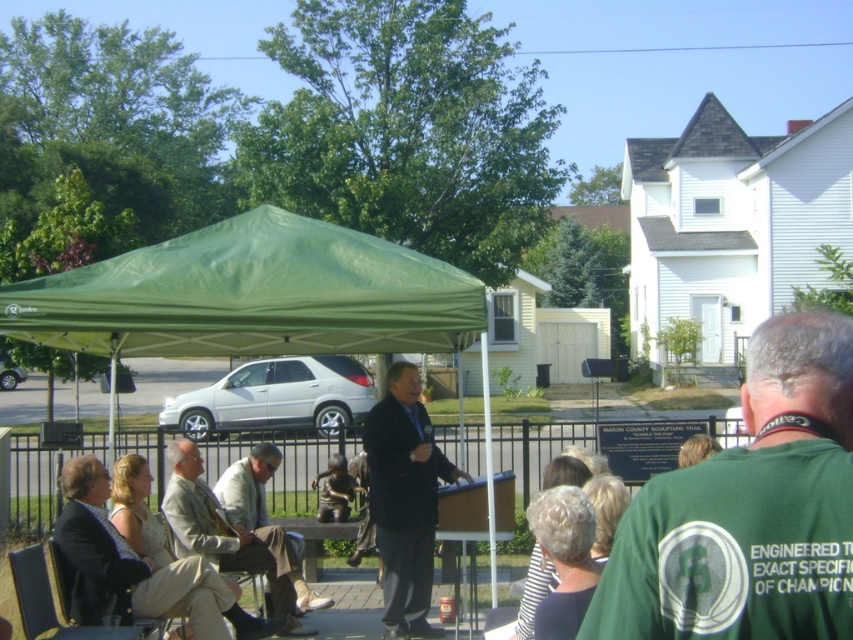
You are attending an outdoor event and notice a person wearing a green fabric shirt at center and light beige fabric pants at center. From your perspective, which clothing item is closer to you?

The green fabric shirt at center is closer to you because it is in front of the light beige fabric pants at center.

You are standing at the center of the outdoor event area. There is a point marked at coordinates (252, 296). What object is located at that point?

The point at coordinates (252, 296) marks the green fabric tent at center.